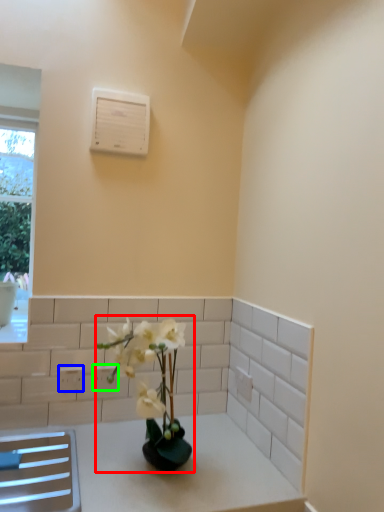
Question: Estimate the real-world distances between objects in this image. Which object is farther from houseplant (highlighted by a red box), electric outlet (highlighted by a blue box) or electric outlet (highlighted by a green box)?

Choices:
 (A) electric outlet
 (B) electric outlet

Answer: (A)